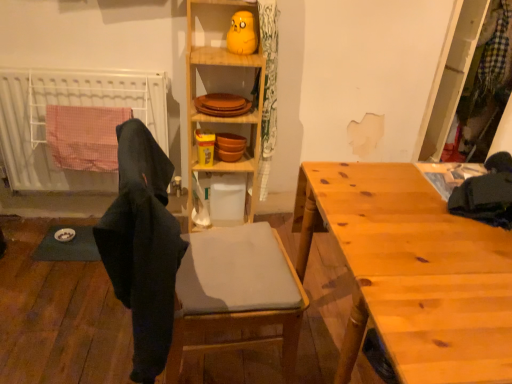
Measure the distance between white plastic radiator at left and camera.

The distance of white plastic radiator at left from camera is 1.90 meters.

The width and height of the screenshot is (512, 384). Identify the location of black fabric at left. (143, 247).

You are a GUI agent. You are given a task and a screenshot of the screen. Output one action in this format:
    pyautogui.click(x=<x>, y=<y>)
    Task: Click on the matte gray cushioned chair at center
    This screenshot has width=512, height=384.
    Given the screenshot: What is the action you would take?
    pyautogui.click(x=165, y=265)

The width and height of the screenshot is (512, 384). Describe the element at coordinates (224, 117) in the screenshot. I see `wooden cabinet at center` at that location.

What are the coordinates of `matte yellow rubber duck at upper center` in the screenshot? It's located at (242, 34).

You are a GUI agent. You are given a task and a screenshot of the screen. Output one action in this format:
    pyautogui.click(x=<x>, y=<y>)
    Task: Click on the white plastic radiator at left
    The image size is (512, 384).
    Given the screenshot: What is the action you would take?
    pyautogui.click(x=69, y=105)

Who is smaller, matte gray cushioned chair at center or black fabric at left?

black fabric at left.

Between matte gray cushioned chair at center and black fabric at left, which one has less height?

Standing shorter between the two is black fabric at left.

Visually, is matte gray cushioned chair at center positioned to the left or to the right of black fabric at left?

Based on their positions, matte gray cushioned chair at center is located to the right of black fabric at left.

Which is in front, point (252, 26) or point (137, 342)?

The point (137, 342) is closer to the camera.

Is matte yellow rubber duck at upper center not inside black fabric at left?

Absolutely, matte yellow rubber duck at upper center is external to black fabric at left.

From a real-world perspective, is matte yellow rubber duck at upper center positioned under black fabric at left based on gravity?

No, from a real-world perspective, matte yellow rubber duck at upper center is not beneath black fabric at left.

Considering the relative positions of wooden plates at upper center and matte yellow rubber duck at upper center in the image provided, is wooden plates at upper center to the left of matte yellow rubber duck at upper center from the viewer's perspective?

Correct, you'll find wooden plates at upper center to the left of matte yellow rubber duck at upper center.

From the image's perspective, between wooden plates at upper center and matte yellow rubber duck at upper center, who is located below?

From the image's view, wooden plates at upper center is below.

Is the surface of wooden plates at upper center in direct contact with matte yellow rubber duck at upper center?

No, wooden plates at upper center is not with matte yellow rubber duck at upper center.

Which of these two, wooden plates at upper center or matte yellow rubber duck at upper center, stands shorter?

Standing shorter between the two is wooden plates at upper center.

From the image's perspective, between wooden cabinet at center and wooden table at right, which one is located above?

wooden cabinet at center appears higher in the image.

Which of these two, wooden cabinet at center or wooden table at right, is thinner?

With smaller width is wooden cabinet at center.

Can we say wooden cabinet at center lies outside wooden table at right?

That's correct, wooden cabinet at center is outside of wooden table at right.

Is wooden cabinet at center facing towards wooden table at right?

No, wooden cabinet at center is not oriented towards wooden table at right.

Considering the relative sizes of wooden cabinet at center and wooden plates at upper center in the image provided, is wooden cabinet at center smaller than wooden plates at upper center?

No.

How different are the orientations of wooden cabinet at center and wooden plates at upper center in degrees?

2 degrees separate the facing orientations of wooden cabinet at center and wooden plates at upper center.

Does point (191, 132) come behind point (255, 85)?

No.

Choose the correct answer: Is black fabric at left inside wooden plates at upper center or outside it?

black fabric at left cannot be found inside wooden plates at upper center.

Is point (138, 191) positioned in front of point (257, 108)?

Yes, it is.

Who is shorter, black fabric at left or wooden plates at upper center?

wooden plates at upper center.

Does black fabric at left have a larger size compared to wooden plates at upper center?

Yes, black fabric at left is bigger than wooden plates at upper center.

This screenshot has width=512, height=384. In order to click on radiator to the left of matte yellow rubber duck at upper center in this screenshot , I will do `click(69, 105)`.

Is white plastic radiator at left completely or partially inside matte yellow rubber duck at upper center?

Definitely not — white plastic radiator at left is not inside matte yellow rubber duck at upper center.

Is matte yellow rubber duck at upper center wider or thinner than white plastic radiator at left?

Clearly, matte yellow rubber duck at upper center has less width compared to white plastic radiator at left.

Is the surface of matte yellow rubber duck at upper center in direct contact with white plastic radiator at left?

No, matte yellow rubber duck at upper center is not with white plastic radiator at left.

You are a GUI agent. You are given a task and a screenshot of the screen. Output one action in this format:
    pyautogui.click(x=<x>, y=<y>)
    Task: Click on the clothing on the left of matte gray cushioned chair at center
    The width and height of the screenshot is (512, 384).
    Given the screenshot: What is the action you would take?
    pyautogui.click(x=143, y=247)

Find the location of a particular element. The width and height of the screenshot is (512, 384). toy that appears behind the black fabric at left is located at coordinates (242, 34).

Looking at the image, which one is located closer to wooden plates at upper center, matte yellow rubber duck at upper center or wooden table at right?

matte yellow rubber duck at upper center.

Based on their spatial positions, is matte yellow rubber duck at upper center or black fabric at left closer to wooden plates at upper center?

matte yellow rubber duck at upper center is closer to wooden plates at upper center.

Based on their spatial positions, is wooden plates at upper center or wooden cabinet at center further from white plastic radiator at left?

The object further to white plastic radiator at left is wooden plates at upper center.

From the image, which object appears to be nearer to white plastic radiator at left, wooden cabinet at center or matte gray cushioned chair at center?

The object closer to white plastic radiator at left is wooden cabinet at center.

From the image, which object appears to be nearer to matte yellow rubber duck at upper center, matte gray cushioned chair at center or wooden plates at upper center?

Based on the image, wooden plates at upper center appears to be nearer to matte yellow rubber duck at upper center.

Considering their positions, is matte yellow rubber duck at upper center positioned closer to matte gray cushioned chair at center than wooden cabinet at center?

wooden cabinet at center is positioned closer to the anchor matte gray cushioned chair at center.

Which object lies nearer to the anchor point wooden cabinet at center, wooden plates at upper center or black fabric at left?

Based on the image, wooden plates at upper center appears to be nearer to wooden cabinet at center.

Estimate the real-world distances between objects in this image. Which object is further from matte gray cushioned chair at center, wooden cabinet at center or black fabric at left?

wooden cabinet at center is further to matte gray cushioned chair at center.

Locate an element on the screen. This screenshot has height=384, width=512. toy between matte gray cushioned chair at center and white plastic radiator at left from front to back is located at coordinates tap(242, 34).

The height and width of the screenshot is (384, 512). I want to click on shelf between matte yellow rubber duck at upper center and wooden table at right in the vertical direction, so (229, 102).

At what (x,y) coordinates should I click in order to perform the action: click on cabinetry between black fabric at left and matte yellow rubber duck at upper center along the z-axis. Please return your answer as a coordinate pair (x, y). The height and width of the screenshot is (384, 512). Looking at the image, I should click on (224, 117).

The width and height of the screenshot is (512, 384). I want to click on cabinetry located between wooden table at right and wooden plates at upper center in the depth direction, so click(224, 117).